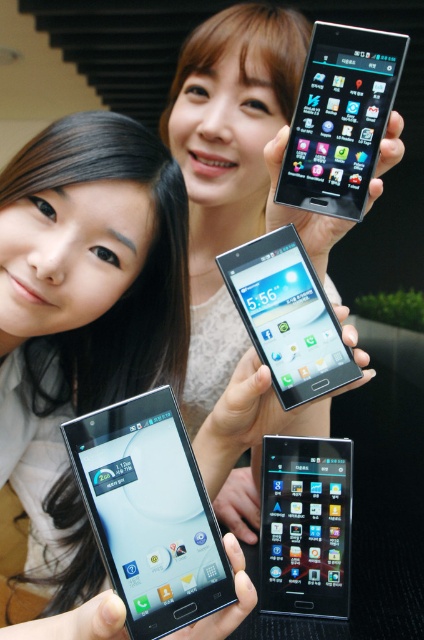
You are at a tech event and see two people holding smartphones. The person on the left holds the satin black smartphone at upper center, and the person on the right holds the satin black smartphone at center. Which smartphone is positioned to the right of the other?

The satin black smartphone at upper center is to the right of the satin black smartphone at center.

You are standing in front of the image and want to locate the matte black smartphone at lower left. According to the coordinates provided, where exactly is it positioned?

The matte black smartphone at lower left is positioned at the 2D coordinates point (x=150, y=513).

Based on the photo, you are standing at the center of the image and want to reach the point labeled as point (164, 564) first before going to point (342, 474). Which direction should you move first?

Since point (164, 564) is in front of point (342, 474), you should move forward towards point (164, 564) first.